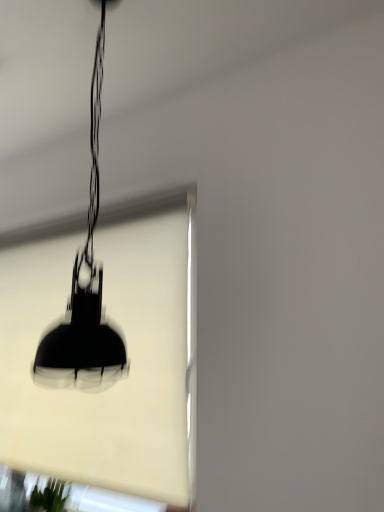
Question: Does black matte lampshade at center turn towards black matte lamp at center?

Choices:
 (A) no
 (B) yes

Answer: (B)

Question: Is black matte lampshade at center at the left side of black matte lamp at center?

Choices:
 (A) no
 (B) yes

Answer: (B)

Question: Is black matte lampshade at center outside black matte lamp at center?

Choices:
 (A) yes
 (B) no

Answer: (A)

Question: Can you confirm if black matte lampshade at center is wider than black matte lamp at center?

Choices:
 (A) yes
 (B) no

Answer: (B)

Question: From the image's perspective, is black matte lampshade at center above black matte lamp at center?

Choices:
 (A) no
 (B) yes

Answer: (A)

Question: Is black matte lampshade at center behind black matte lamp at center?

Choices:
 (A) no
 (B) yes

Answer: (B)

Question: Can you confirm if black matte lamp at center is wider than black matte lampshade at center?

Choices:
 (A) yes
 (B) no

Answer: (A)

Question: Is black matte lamp at center next to black matte lampshade at center?

Choices:
 (A) yes
 (B) no

Answer: (B)

Question: From the image's perspective, is black matte lamp at center under black matte lampshade at center?

Choices:
 (A) yes
 (B) no

Answer: (B)

Question: Can we say black matte lamp at center lies outside black matte lampshade at center?

Choices:
 (A) no
 (B) yes

Answer: (B)

Question: From a real-world perspective, is black matte lamp at center located higher than black matte lampshade at center?

Choices:
 (A) no
 (B) yes

Answer: (B)

Question: From a real-world perspective, is black matte lamp at center below black matte lampshade at center?

Choices:
 (A) no
 (B) yes

Answer: (A)

Question: In the image, is black matte lampshade at center on the left side or the right side of black matte lamp at center?

Choices:
 (A) right
 (B) left

Answer: (B)